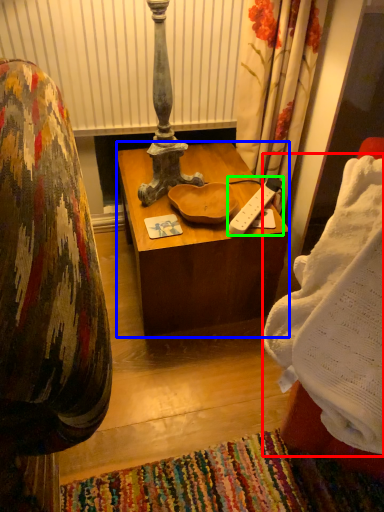
Question: Which object is positioned closest to blanket (highlighted by a red box)? Select from desk (highlighted by a blue box) and remote control (highlighted by a green box).

Choices:
 (A) desk
 (B) remote control

Answer: (B)